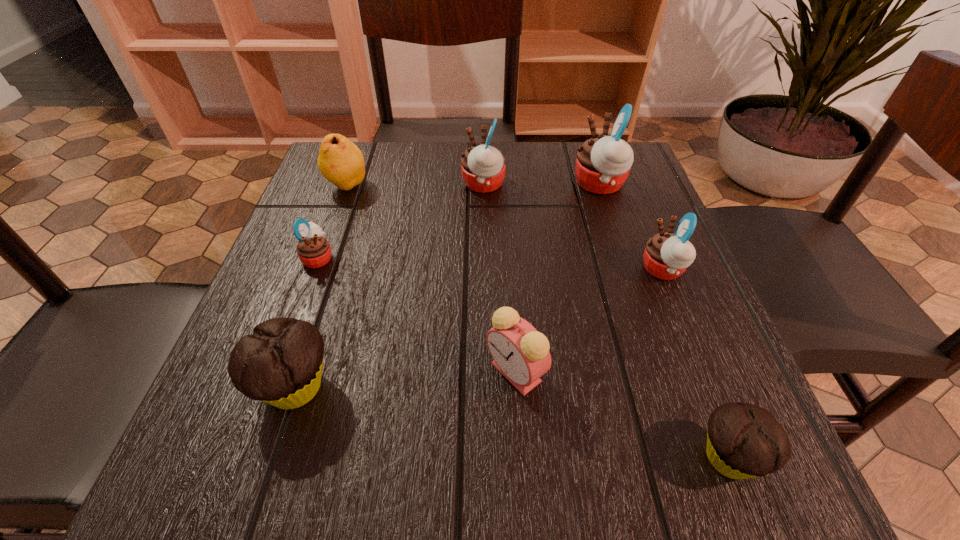
At what (x,y) coordinates should I click in order to perform the action: click on vacant area situated 0.370m on the front-facing side of the tallest object. Please return your answer as a coordinate pair (x, y). The image size is (960, 540). Looking at the image, I should click on (407, 184).

This screenshot has height=540, width=960. Identify the location of vacant space situated on the front-facing side of the tallest object. (511, 184).

What are the coordinates of `vacant space located on the front-facing side of the tallest object` in the screenshot? It's located at (488, 184).

This screenshot has height=540, width=960. In order to click on free space located on the front-facing side of the second pink muffin from left to right in this screenshot , I will do [407, 185].

This screenshot has width=960, height=540. In order to click on free space located 0.210m on the front-facing side of the second pink muffin from left to right in this screenshot , I will do `click(368, 185)`.

In order to click on vacant space situated on the front-facing side of the second pink muffin from left to right in this screenshot , I will do `click(395, 185)`.

This screenshot has height=540, width=960. What are the coordinates of `vacant space situated 0.200m on the right of the pear` in the screenshot? It's located at (459, 186).

This screenshot has height=540, width=960. In order to click on free region located on the front-facing side of the third biggest pink muffin in this screenshot , I will do `click(542, 270)`.

Identify the location of vacant area situated 0.140m on the front-facing side of the third biggest pink muffin. (564, 270).

The width and height of the screenshot is (960, 540). Find the location of `vacant space located on the front-facing side of the third biggest pink muffin`. vacant space located on the front-facing side of the third biggest pink muffin is located at coordinates (443, 270).